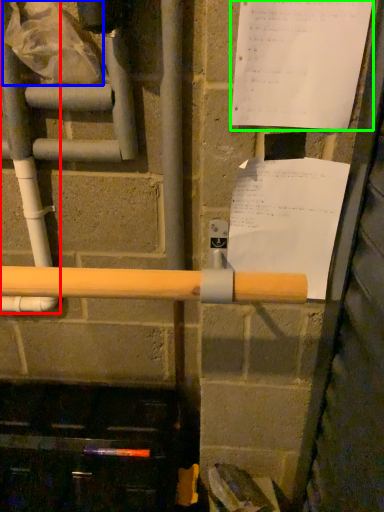
Question: Considering the real-world distances, which object is farthest from water pipe (highlighted by a red box)? plastic bag (highlighted by a blue box) or paper (highlighted by a green box)?

Choices:
 (A) plastic bag
 (B) paper

Answer: (B)